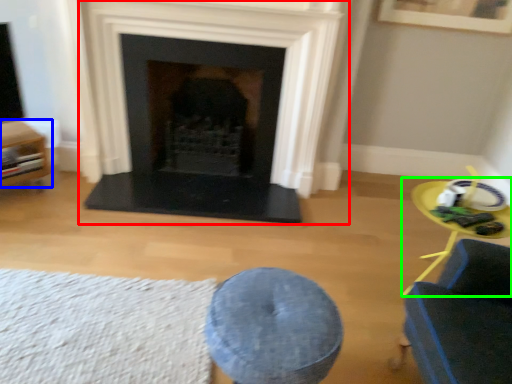
Question: Estimate the real-world distances between objects in this image. Which object is farther from fireplace (highlighted by a red box), furniture (highlighted by a blue box) or round table (highlighted by a green box)?

Choices:
 (A) furniture
 (B) round table

Answer: (B)